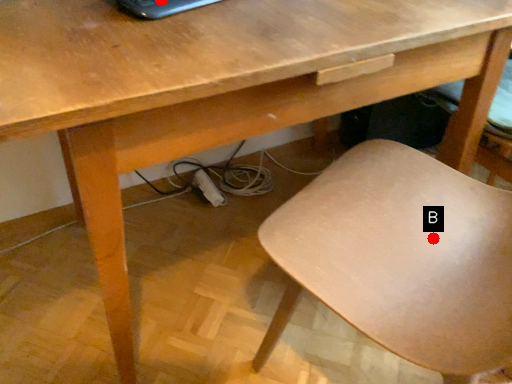
Question: Two points are circled on the image, labeled by A and B beside each circle. Among these points, which one is farthest from the camera?

Choices:
 (A) A is further
 (B) B is further

Answer: (B)